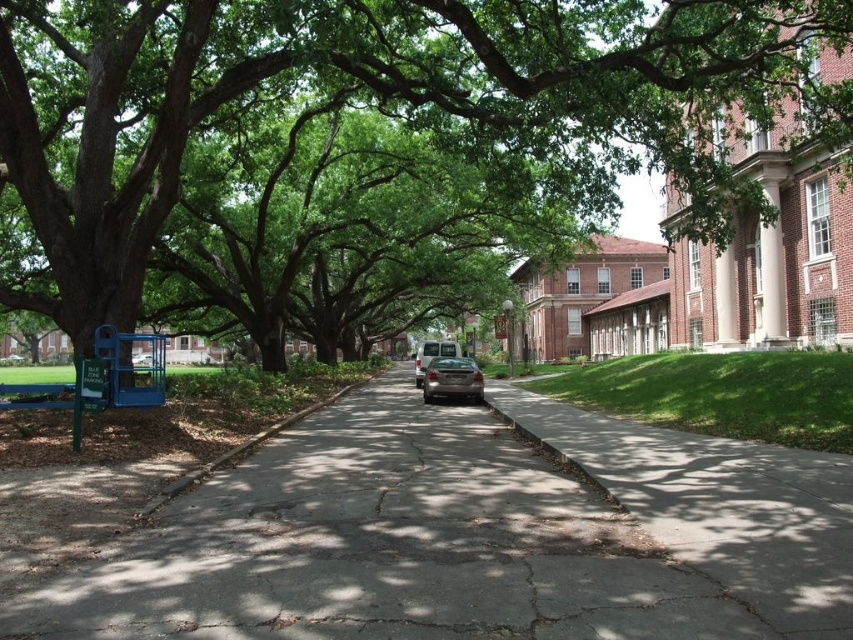
Between white smooth column at upper right and gray concrete curb at center, which one has more height?

gray concrete curb at center is taller.

What do you see at coordinates (770, 282) in the screenshot?
I see `white smooth column at upper right` at bounding box center [770, 282].

Locate an element on the screen. The image size is (853, 640). white smooth column at upper right is located at coordinates (770, 282).

Between point (186, 80) and point (773, 202), which one is positioned in front?

Point (186, 80)

Does green leafy tree at left have a smaller size compared to white smooth column at upper right?

Actually, green leafy tree at left might be larger than white smooth column at upper right.

Is point (680, 113) farther from camera compared to point (772, 257)?

No, (680, 113) is closer to viewer.

This screenshot has width=853, height=640. I want to click on green leafy tree at left, so [x=381, y=140].

Does white smooth column at upper right have a greater width compared to metallic silver van at center?

In fact, white smooth column at upper right might be narrower than metallic silver van at center.

Which is in front, point (780, 284) or point (418, 365)?

Point (780, 284) is in front.

Where is `white smooth column at upper right`? The width and height of the screenshot is (853, 640). white smooth column at upper right is located at coordinates (770, 282).

The width and height of the screenshot is (853, 640). Identify the location of white smooth column at upper right. (770, 282).